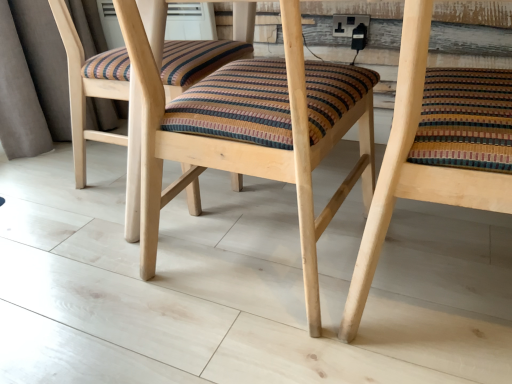
Identify the location of blank area beneath wooden chair at center, which appears as the 2th chair when viewed from the left (from a real-world perspective). (437, 288).